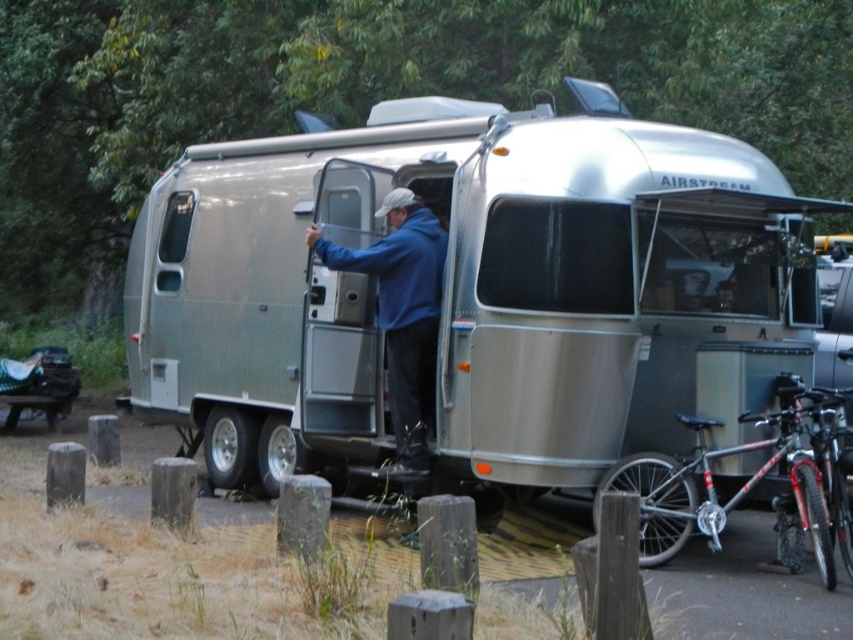
You are a hiker who just arrived at the campsite and see the silver metallic trailer at center and the blue matte jacket at center. Which object is higher in elevation?

The silver metallic trailer at center is above the blue matte jacket at center, so the silver metallic trailer at center is higher in elevation.

You are standing in front of the silver Airstream trailer and want to place a small flag at the point closer to you between point (277,285) and point (428,352). Which point should you choose?

Point (277,285) is further to the camera than point (428,352), so you should choose point (428,352) as it is closer to you.